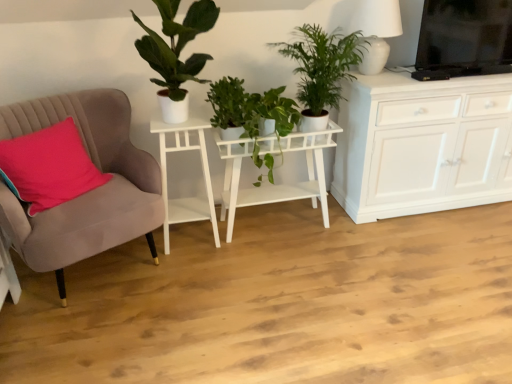
This screenshot has width=512, height=384. Find the location of `vacant region below white matte side table at left, placed as the second table when sorted from right to left (from a real-world perspective)`. vacant region below white matte side table at left, placed as the second table when sorted from right to left (from a real-world perspective) is located at coordinates (192, 236).